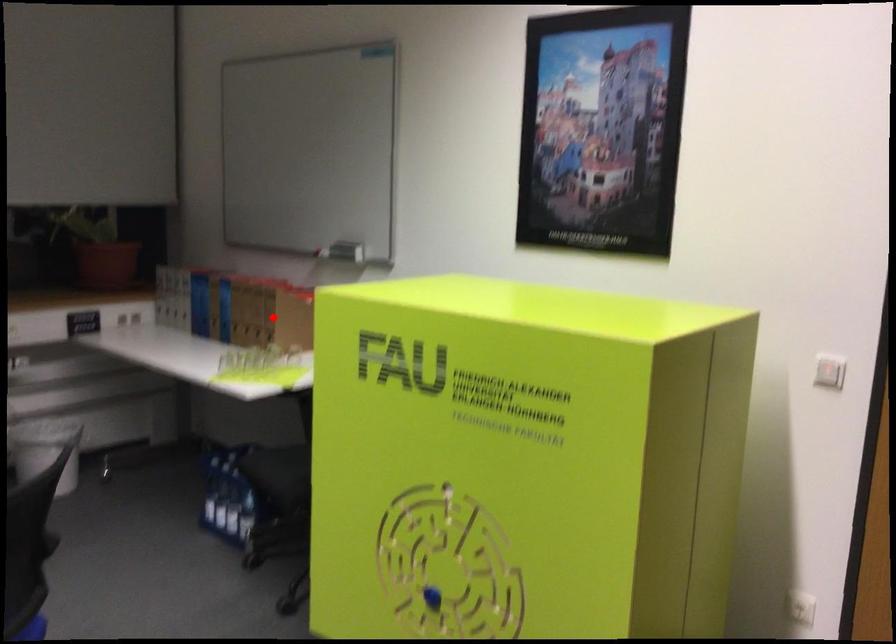
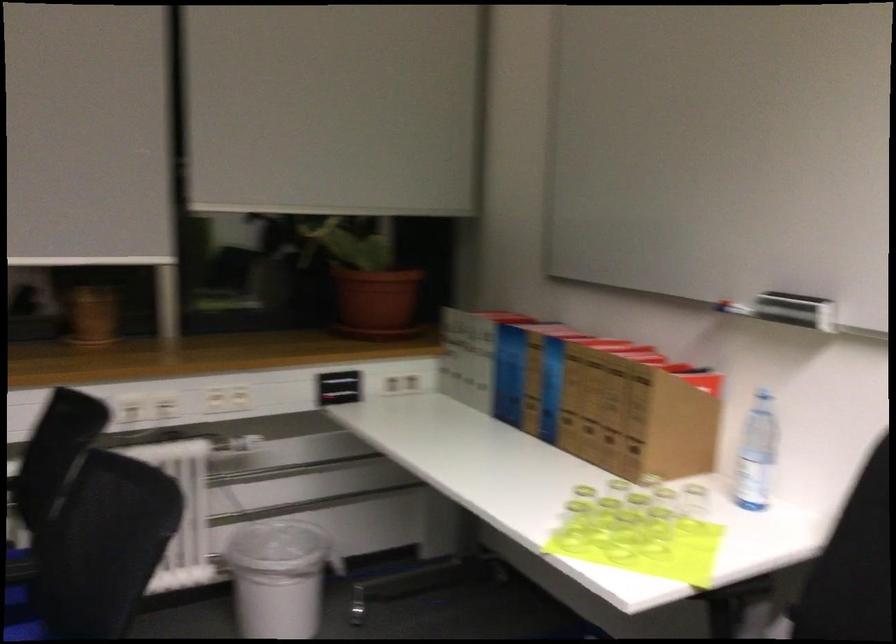
Question: I am providing you with two images of the same scene from different viewpoints. A red point is shown in image1. For the corresponding object point in image2, is it positioned nearer or farther from the camera?

Choices:
 (A) Nearer
 (B) Farther

Answer: (A)